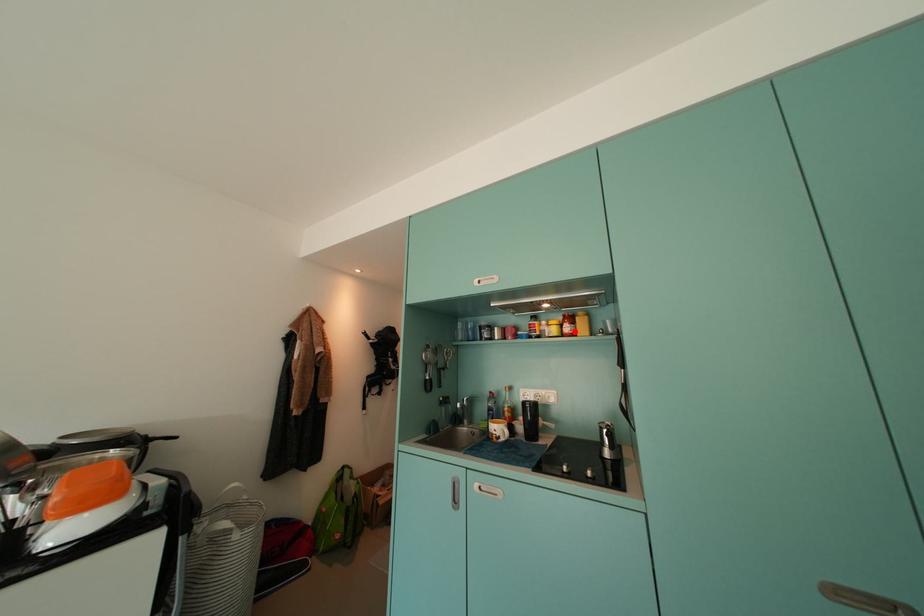
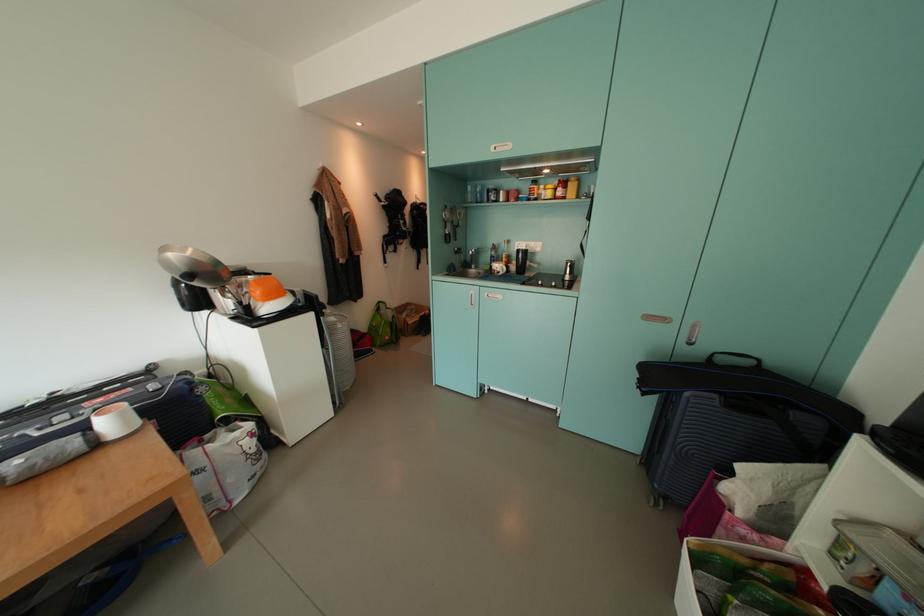
Question: I am providing you with two images of the same scene from different viewpoints. A red point is marked on the first image. Is the red point's position out of view in image 2?

Choices:
 (A) Yes
 (B) No

Answer: (B)